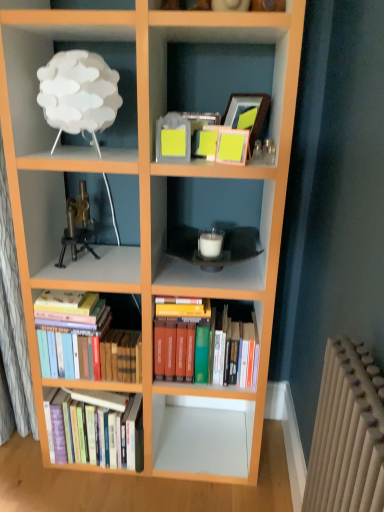
The image size is (384, 512). I want to click on hardcover books at lower left, arranged as the 2th book when viewed from the left, so click(x=86, y=343).

At what (x,y) coordinates should I click in order to perform the action: click on hardcover books at center, the first book viewed from the right. Please return your answer as a coordinate pair (x, y). This screenshot has width=384, height=512. Looking at the image, I should click on (182, 341).

Considering the positions of points (78, 421) and (158, 321), is point (78, 421) farther from camera compared to point (158, 321)?

Yes, it is.

From the image's perspective, is hardcover books at lower left, the first book positioned from the left, above or below hardcover books at center, the third book positioned from the left?

Clearly, from the image's perspective, hardcover books at lower left, the first book positioned from the left, is below hardcover books at center, the third book positioned from the left.

Is hardcover books at lower left, arranged as the third book when viewed from the right, thinner than hardcover books at center, the third book positioned from the left?

Yes, hardcover books at lower left, arranged as the third book when viewed from the right, is thinner than hardcover books at center, the third book positioned from the left.

Where is `the 2nd book in front of the hardcover books at lower left, arranged as the third book when viewed from the right`? Image resolution: width=384 pixels, height=512 pixels. the 2nd book in front of the hardcover books at lower left, arranged as the third book when viewed from the right is located at coordinates pyautogui.click(x=182, y=341).

How many degrees apart are the facing directions of hardcover books at center, the first book viewed from the right, and hardcover books at lower left, the first book positioned from the left?

3.2 degrees separate the facing orientations of hardcover books at center, the first book viewed from the right, and hardcover books at lower left, the first book positioned from the left.

Does hardcover books at center, the first book viewed from the right, come in front of hardcover books at lower left, arranged as the third book when viewed from the right?

Yes.

Considering the sizes of objects hardcover books at center, the third book positioned from the left, and hardcover books at lower left, the first book positioned from the left, in the image provided, who is smaller, hardcover books at center, the third book positioned from the left, or hardcover books at lower left, the first book positioned from the left,?

hardcover books at lower left, the first book positioned from the left.

Is hardcover books at center, the third book positioned from the left, oriented towards white matte lamp at upper left?

No.

From the picture: Considering the sizes of hardcover books at center, the first book viewed from the right, and white matte lamp at upper left in the image, is hardcover books at center, the first book viewed from the right, wider or thinner than white matte lamp at upper left?

Clearly, hardcover books at center, the first book viewed from the right, has more width compared to white matte lamp at upper left.

Does hardcover books at center, the third book positioned from the left, come behind white matte lamp at upper left?

Yes, the depth of hardcover books at center, the third book positioned from the left, is greater than that of white matte lamp at upper left.

Who is shorter, hardcover books at center, the first book viewed from the right, or white matte lamp at upper left?

white matte lamp at upper left.

Which object is closer to the camera taking this photo, hardcover books at lower left, arranged as the third book when viewed from the right, or hardcover books at lower left, marked as the 2th book in a right-to-left arrangement?

hardcover books at lower left, marked as the 2th book in a right-to-left arrangement, is in front.

From a real-world perspective, is hardcover books at lower left, arranged as the third book when viewed from the right, over hardcover books at lower left, marked as the 2th book in a right-to-left arrangement?

No.

Does hardcover books at lower left, arranged as the third book when viewed from the right, have a greater width compared to hardcover books at lower left, marked as the 2th book in a right-to-left arrangement?

Yes.

Is hardcover books at lower left, arranged as the third book when viewed from the right, bigger than hardcover books at lower left, marked as the 2th book in a right-to-left arrangement?

Yes, hardcover books at lower left, arranged as the third book when viewed from the right, is bigger than hardcover books at lower left, marked as the 2th book in a right-to-left arrangement.

From the image's perspective, which object appears higher, hardcover books at lower left, arranged as the 2th book when viewed from the left, or brass/bronze tripod at center-left?

brass/bronze tripod at center-left, from the image's perspective.

Is hardcover books at lower left, arranged as the 2th book when viewed from the left, positioned behind brass/bronze tripod at center-left?

Yes.

Locate an element on the screen. This screenshot has width=384, height=512. the 2nd book behind the brass/bronze tripod at center-left, counting from the anchor's position is located at coordinates (86, 343).

Is point (63, 242) in front of point (183, 362)?

No, it is behind (183, 362).

Considering the relative positions of brass/bronze tripod at center-left and hardcover books at center, the third book positioned from the left, in the image provided, is brass/bronze tripod at center-left to the left of hardcover books at center, the third book positioned from the left, from the viewer's perspective?

Yes, brass/bronze tripod at center-left is to the left of hardcover books at center, the third book positioned from the left.

From a real-world perspective, who is located higher, brass/bronze tripod at center-left or hardcover books at center, the third book positioned from the left?

From a 3D spatial view, brass/bronze tripod at center-left is above.

Are hardcover books at center, the third book positioned from the left, and brass/bronze tripod at center-left beside each other?

hardcover books at center, the third book positioned from the left, is not next to brass/bronze tripod at center-left, and they're not touching.

From a real-world perspective, between hardcover books at center, the third book positioned from the left, and brass/bronze tripod at center-left, who is vertically higher?

From a 3D spatial view, brass/bronze tripod at center-left is above.

Is point (243, 311) closer to camera compared to point (68, 203)?

Yes, point (243, 311) is closer to viewer.

Where is `the 2nd book to the left of the hardcover books at center, the third book positioned from the left, counting from the anchor's position`? The height and width of the screenshot is (512, 384). the 2nd book to the left of the hardcover books at center, the third book positioned from the left, counting from the anchor's position is located at coordinates (93, 430).

From a real-world perspective, count 2nd books downward from the hardcover books at center, the first book viewed from the right, and point to it. Please provide its 2D coordinates.

[(93, 430)]

Which object lies further to the anchor point hardcover books at lower left, arranged as the 2th book when viewed from the left, hardcover books at lower left, the first book positioned from the left, or hardcover books at center, the first book viewed from the right?

hardcover books at center, the first book viewed from the right.

Which object lies further to the anchor point hardcover books at lower left, marked as the 2th book in a right-to-left arrangement, hardcover books at lower left, the first book positioned from the left, or white matte lamp at upper left?

white matte lamp at upper left lies further to hardcover books at lower left, marked as the 2th book in a right-to-left arrangement, than the other object.

Estimate the real-world distances between objects in this image. Which object is further from brass/bronze tripod at center-left, hardcover books at center, the third book positioned from the left, or hardcover books at lower left, arranged as the third book when viewed from the right?

hardcover books at lower left, arranged as the third book when viewed from the right.

Looking at the image, which one is located closer to hardcover books at center, the third book positioned from the left, white matte lamp at upper left or brass/bronze tripod at center-left?

brass/bronze tripod at center-left is closer to hardcover books at center, the third book positioned from the left.

Looking at the image, which one is located further to hardcover books at center, the third book positioned from the left, brass/bronze tripod at center-left or white matte lamp at upper left?

Among the two, white matte lamp at upper left is located further to hardcover books at center, the third book positioned from the left.

Which object lies further to the anchor point hardcover books at center, the third book positioned from the left, hardcover books at lower left, arranged as the 2th book when viewed from the left, or brass/bronze tripod at center-left?

The object further to hardcover books at center, the third book positioned from the left, is brass/bronze tripod at center-left.

Based on their spatial positions, is hardcover books at lower left, arranged as the third book when viewed from the right, or brass/bronze tripod at center-left further from hardcover books at lower left, marked as the 2th book in a right-to-left arrangement?

brass/bronze tripod at center-left lies further to hardcover books at lower left, marked as the 2th book in a right-to-left arrangement, than the other object.

Looking at the image, which one is located further to white matte lamp at upper left, brass/bronze tripod at center-left or hardcover books at lower left, the first book positioned from the left?

hardcover books at lower left, the first book positioned from the left, is positioned further to the anchor white matte lamp at upper left.

Identify the location of toy between white matte lamp at upper left and hardcover books at lower left, arranged as the third book when viewed from the right, in the vertical direction. (77, 226).

Find the location of `book between hardcover books at lower left, the first book positioned from the left, and hardcover books at center, the first book viewed from the right, from left to right`. book between hardcover books at lower left, the first book positioned from the left, and hardcover books at center, the first book viewed from the right, from left to right is located at coordinates [86, 343].

The width and height of the screenshot is (384, 512). Find the location of `toy between white matte lamp at upper left and hardcover books at lower left, arranged as the 2th book when viewed from the left, vertically`. toy between white matte lamp at upper left and hardcover books at lower left, arranged as the 2th book when viewed from the left, vertically is located at coordinates (77, 226).

Image resolution: width=384 pixels, height=512 pixels. I want to click on toy between white matte lamp at upper left and hardcover books at center, the first book viewed from the right, from top to bottom, so click(x=77, y=226).